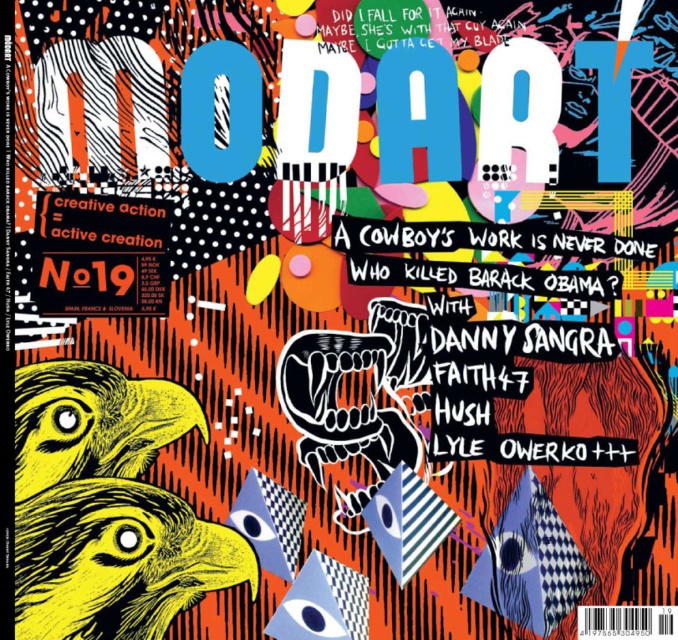
You are designing a layout for the MODART cover and need to place a new element near the yellow linework eagle at lower left. Based on its current position, what are the coordinates where you should place the new element to ensure it aligns with the eagle?

The yellow linework eagle at lower left is located at point (117, 561), so you should place the new element near these coordinates to align with it.

You are an art student analyzing the MODART cover. You notice two eagles labeled as yellow linework eagle at lower left and yellow linocut eagle at lower left. Which one appears to be in front?

The yellow linework eagle at lower left is closer to the viewer than the yellow linocut eagle at lower left, so it appears in front.